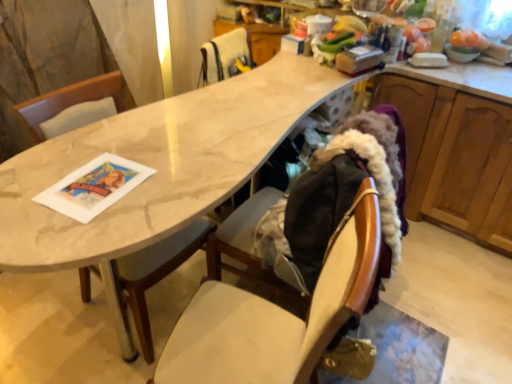
Question: Does wooden cabinet at right turn towards wooden chair at center, the 1th chair in the front-to-back sequence?

Choices:
 (A) no
 (B) yes

Answer: (A)

Question: Is wooden cabinet at right outside wooden chair at center, which appears as the second chair when viewed from the top?

Choices:
 (A) yes
 (B) no

Answer: (A)

Question: From a real-world perspective, is wooden cabinet at right located higher than wooden chair at center, arranged as the first chair when ordered from the bottom?

Choices:
 (A) yes
 (B) no

Answer: (B)

Question: From the image's perspective, would you say wooden cabinet at right is positioned over wooden chair at center, arranged as the first chair when ordered from the bottom?

Choices:
 (A) no
 (B) yes

Answer: (B)

Question: Does wooden cabinet at right lie behind wooden chair at center, which appears as the second chair when viewed from the top?

Choices:
 (A) yes
 (B) no

Answer: (A)

Question: Is wooden chair at center, the 1th chair in the front-to-back sequence, wider or thinner than wooden cabinet at right?

Choices:
 (A) wide
 (B) thin

Answer: (B)

Question: From their relative heights in the image, would you say wooden chair at center, arranged as the first chair when ordered from the bottom, is taller or shorter than wooden cabinet at right?

Choices:
 (A) tall
 (B) short

Answer: (A)

Question: From the image's perspective, is wooden chair at center, which appears as the second chair when viewed from the top, located above or below wooden cabinet at right?

Choices:
 (A) below
 (B) above

Answer: (A)

Question: Would you say wooden chair at center, arranged as the 2th chair when viewed from the back, is to the left or to the right of wooden cabinet at right in the picture?

Choices:
 (A) right
 (B) left

Answer: (B)

Question: Is wooden chair at center, the 1th chair in the front-to-back sequence, bigger or smaller than white fur at upper center, the 1th chair from the back?

Choices:
 (A) small
 (B) big

Answer: (B)

Question: From a real-world perspective, is wooden chair at center, which appears as the second chair when viewed from the top, positioned above or below white fur at upper center, which is counted as the 1th chair, starting from the top?

Choices:
 (A) above
 (B) below

Answer: (B)

Question: Considering the positions of wooden chair at center, arranged as the 2th chair when viewed from the back, and white fur at upper center, positioned as the 2th chair in front-to-back order, in the image, is wooden chair at center, arranged as the 2th chair when viewed from the back, taller or shorter than white fur at upper center, positioned as the 2th chair in front-to-back order,?

Choices:
 (A) short
 (B) tall

Answer: (B)

Question: Is wooden chair at center, arranged as the first chair when ordered from the bottom, in front of or behind white fur at upper center, the 1th chair from the back, in the image?

Choices:
 (A) behind
 (B) front

Answer: (B)

Question: Does point (417, 220) appear closer or farther from the camera than point (274, 345)?

Choices:
 (A) closer
 (B) farther

Answer: (B)

Question: Is wooden cabinet at right situated inside wooden chair at center, which appears as the second chair when viewed from the top, or outside?

Choices:
 (A) inside
 (B) outside

Answer: (B)